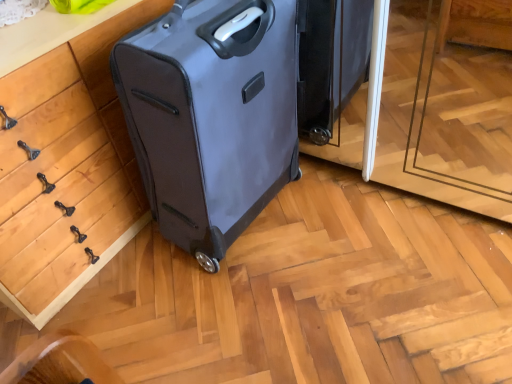
Question: Could matte black suitcase at center be considered to be inside wooden drawer at left?

Choices:
 (A) yes
 (B) no

Answer: (B)

Question: From the image's perspective, is wooden drawer at left on top of matte black suitcase at center?

Choices:
 (A) no
 (B) yes

Answer: (A)

Question: Considering the relative positions of wooden drawer at left and matte black suitcase at center in the image provided, is wooden drawer at left to the left of matte black suitcase at center from the viewer's perspective?

Choices:
 (A) no
 (B) yes

Answer: (B)

Question: Can you confirm if wooden drawer at left is positioned to the right of matte black suitcase at center?

Choices:
 (A) no
 (B) yes

Answer: (A)

Question: From a real-world perspective, is wooden drawer at left over matte black suitcase at center?

Choices:
 (A) no
 (B) yes

Answer: (A)

Question: Does wooden drawer at left have a greater width compared to matte black suitcase at center?

Choices:
 (A) no
 (B) yes

Answer: (B)

Question: Does matte black suitcase at center have a greater width compared to wooden drawer at left?

Choices:
 (A) yes
 (B) no

Answer: (B)

Question: Does matte black suitcase at center have a lesser height compared to wooden drawer at left?

Choices:
 (A) yes
 (B) no

Answer: (B)

Question: Is matte black suitcase at center bigger than wooden drawer at left?

Choices:
 (A) no
 (B) yes

Answer: (A)

Question: Is matte black suitcase at center closer to camera compared to wooden drawer at left?

Choices:
 (A) yes
 (B) no

Answer: (B)

Question: Is matte black suitcase at center at the right side of wooden drawer at left?

Choices:
 (A) yes
 (B) no

Answer: (A)

Question: Does matte black suitcase at center have a greater height compared to wooden drawer at left?

Choices:
 (A) yes
 (B) no

Answer: (A)

Question: Is wooden drawer at left situated inside matte black suitcase at center or outside?

Choices:
 (A) outside
 (B) inside

Answer: (A)